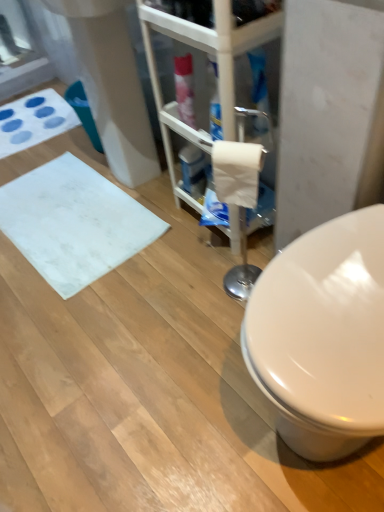
Question: From the image's perspective, relative to white matte toilet paper at center, is white matte bath mat at upper left, the 2th bath mat when ordered from bottom to top, above or below?

Choices:
 (A) below
 (B) above

Answer: (B)

Question: Is white matte bath mat at upper left, the 2th bath mat when ordered from bottom to top, bigger or smaller than white matte toilet paper at center?

Choices:
 (A) small
 (B) big

Answer: (B)

Question: Which is farther from the white plastic shelf at center?

Choices:
 (A) white matte toilet paper at center
 (B) white matte bath mat at upper left, the 2th bath mat when ordered from bottom to top
 (C) white matte bath mat at lower left, arranged as the second bath mat when viewed from the top

Answer: (B)

Question: Considering the real-world distances, which object is closest to the white matte bath mat at upper left, positioned as the 2th bath mat in front-to-back order?

Choices:
 (A) white matte toilet paper at center
 (B) white matte bath mat at lower left, the 1th bath mat in the bottom-to-top sequence
 (C) white plastic shelf at center

Answer: (B)